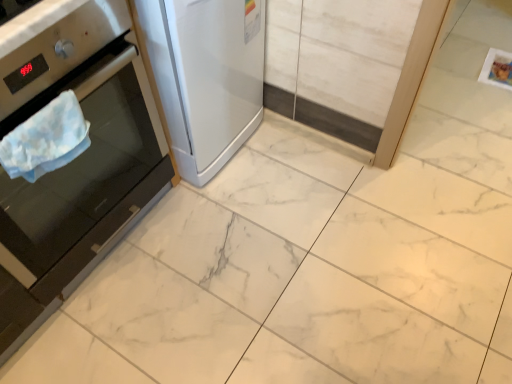
Question: Is stainless steel oven at left, marked as the 1th home appliance in a left-to-right arrangement, inside blue fabric towel at left?

Choices:
 (A) no
 (B) yes

Answer: (A)

Question: Considering the relative sizes of blue fabric towel at left and stainless steel oven at left, the second home appliance viewed from the right, in the image provided, is blue fabric towel at left taller than stainless steel oven at left, the second home appliance viewed from the right,?

Choices:
 (A) no
 (B) yes

Answer: (A)

Question: Does blue fabric towel at left come in front of stainless steel oven at left, the second home appliance viewed from the right?

Choices:
 (A) no
 (B) yes

Answer: (A)

Question: Is blue fabric towel at left at the left side of stainless steel oven at left, marked as the 1th home appliance in a left-to-right arrangement?

Choices:
 (A) yes
 (B) no

Answer: (B)

Question: Does blue fabric towel at left have a smaller size compared to stainless steel oven at left, the second home appliance viewed from the right?

Choices:
 (A) yes
 (B) no

Answer: (A)

Question: From the image's perspective, does blue fabric towel at left appear lower than stainless steel oven at left, the second home appliance viewed from the right?

Choices:
 (A) yes
 (B) no

Answer: (A)

Question: Is satin white refrigerator at left, the 2th home appliance when ordered from left to right, not near blue fabric towel at left?

Choices:
 (A) no
 (B) yes

Answer: (A)

Question: Does satin white refrigerator at left, the 2th home appliance when ordered from left to right, lie behind blue fabric towel at left?

Choices:
 (A) no
 (B) yes

Answer: (B)

Question: Is satin white refrigerator at left, the 2th home appliance when ordered from left to right, thinner than blue fabric towel at left?

Choices:
 (A) yes
 (B) no

Answer: (B)

Question: Considering the relative sizes of satin white refrigerator at left, arranged as the 1th home appliance when viewed from the right, and blue fabric towel at left in the image provided, is satin white refrigerator at left, arranged as the 1th home appliance when viewed from the right, bigger than blue fabric towel at left?

Choices:
 (A) yes
 (B) no

Answer: (A)

Question: From a real-world perspective, is satin white refrigerator at left, arranged as the 1th home appliance when viewed from the right, over blue fabric towel at left?

Choices:
 (A) yes
 (B) no

Answer: (B)

Question: Considering the relative sizes of satin white refrigerator at left, the 2th home appliance when ordered from left to right, and blue fabric towel at left in the image provided, is satin white refrigerator at left, the 2th home appliance when ordered from left to right, smaller than blue fabric towel at left?

Choices:
 (A) yes
 (B) no

Answer: (B)

Question: Would you consider satin white refrigerator at left, arranged as the 1th home appliance when viewed from the right, to be distant from stainless steel oven at left, the second home appliance viewed from the right?

Choices:
 (A) no
 (B) yes

Answer: (A)